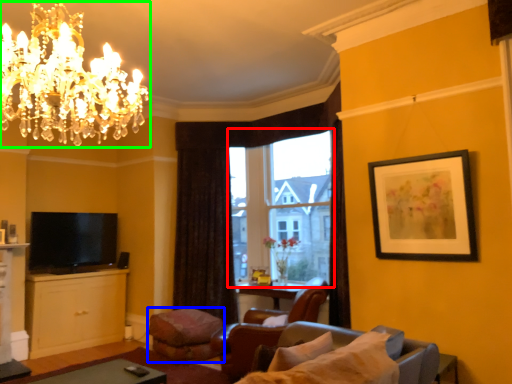
Question: Based on their relative distances, which object is nearer to window (highlighted by a red box)? Choose from footrest (highlighted by a blue box) and chandelier (highlighted by a green box).

Choices:
 (A) footrest
 (B) chandelier

Answer: (A)